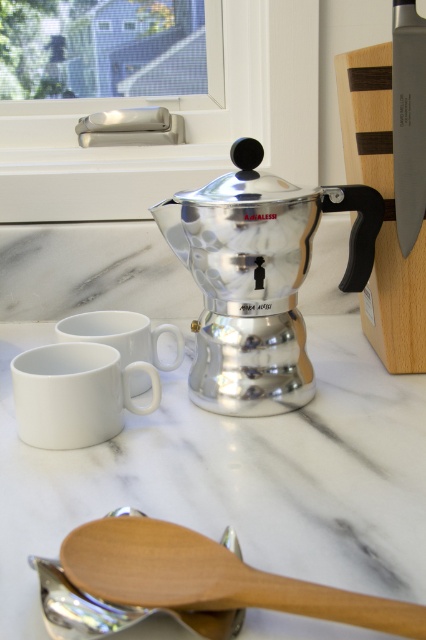
Is point (178, 564) behind point (123, 340)?

No, (178, 564) is closer to viewer.

Who is more forward, [282,584] or [124,353]?

Point [282,584] is in front.

Find the location of a particular element. The height and width of the screenshot is (640, 426). wooden spoon at center is located at coordinates (209, 579).

Consider the image. Is shiny metallic coffee pot at center below wooden spoon at center?

No, shiny metallic coffee pot at center is not below wooden spoon at center.

Does shiny metallic coffee pot at center appear on the left side of wooden spoon at center?

Incorrect, shiny metallic coffee pot at center is not on the left side of wooden spoon at center.

Who is more distant from viewer, (265, 332) or (265, 593)?

Point (265, 332)

Where is `shiny metallic coffee pot at center`? Image resolution: width=426 pixels, height=640 pixels. shiny metallic coffee pot at center is located at coordinates (258, 276).

Which is above, wooden spoon at center or white glossy mug at lower left?

Positioned higher is white glossy mug at lower left.

Looking at this image, is wooden spoon at center smaller than white glossy mug at lower left?

Indeed, wooden spoon at center has a smaller size compared to white glossy mug at lower left.

Does point (360, 602) come closer to viewer compared to point (89, 445)?

Yes, it is in front of point (89, 445).

The width and height of the screenshot is (426, 640). I want to click on wooden spoon at center, so click(x=209, y=579).